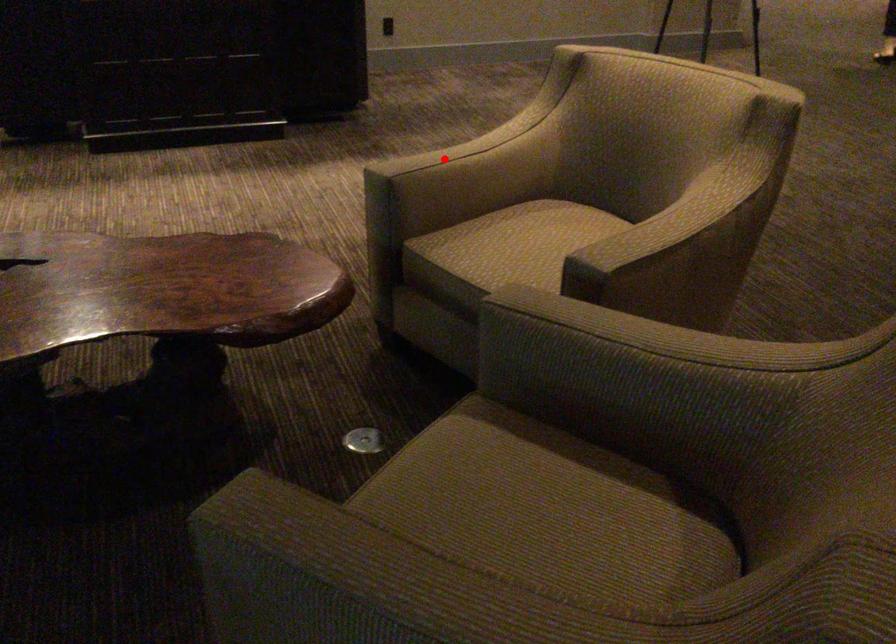
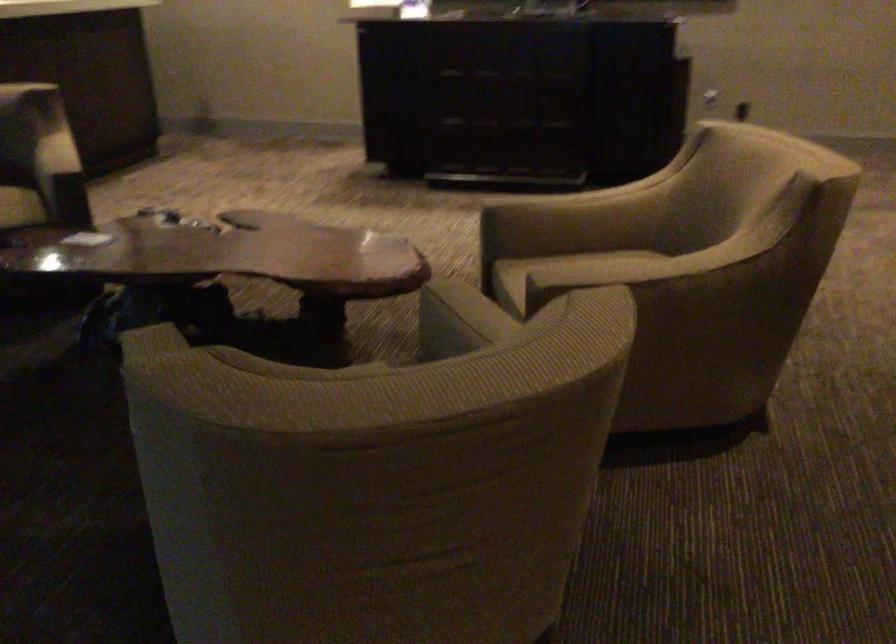
Question: I am providing you with two images of the same scene from different viewpoints. A red point is shown in image1. For the corresponding object point in image2, is it positioned nearer or farther from the camera?

Choices:
 (A) Nearer
 (B) Farther

Answer: (B)